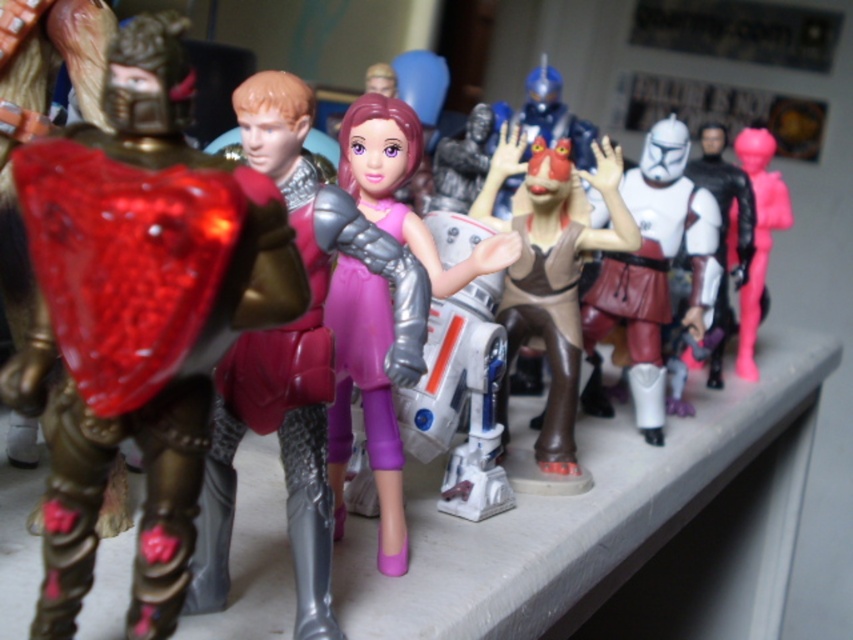
Measure the distance from purple matte/glossy doll at center to white matte helmet at center.

They are 18.12 inches apart.

The height and width of the screenshot is (640, 853). What do you see at coordinates (366, 401) in the screenshot? I see `purple matte/glossy doll at center` at bounding box center [366, 401].

Locate an element on the screen. The image size is (853, 640). purple matte/glossy doll at center is located at coordinates (366, 401).

Measure the distance from white matte helmet at center to pink matte figure at right.

white matte helmet at center is 10.59 inches from pink matte figure at right.

Which of these two, white matte helmet at center or pink matte figure at right, stands shorter?

With less height is white matte helmet at center.

Which is behind, point (717, 227) or point (747, 170)?

Positioned behind is point (747, 170).

Identify the location of white matte helmet at center. This screenshot has width=853, height=640. (x=654, y=268).

Consider the image. Can you confirm if purple matte/glossy doll at center is positioned to the right of pink matte figure at right?

Incorrect, purple matte/glossy doll at center is not on the right side of pink matte figure at right.

Between purple matte/glossy doll at center and pink matte figure at right, which one is positioned higher?

pink matte figure at right is higher up.

Measure the distance between purple matte/glossy doll at center and camera.

purple matte/glossy doll at center and camera are 28.76 inches apart.

This screenshot has height=640, width=853. Find the location of `purple matte/glossy doll at center`. purple matte/glossy doll at center is located at coordinates (366, 401).